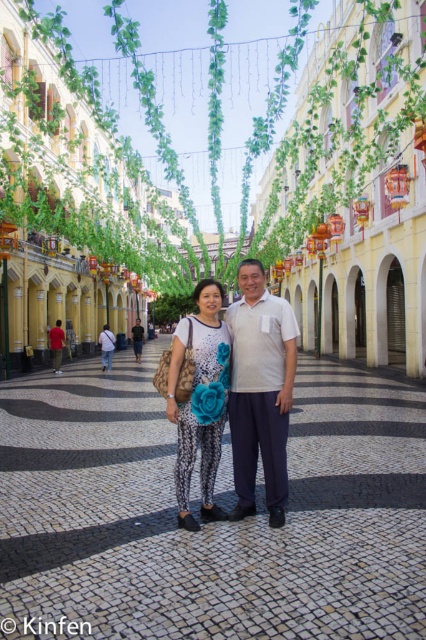
Can you confirm if printed fabric leggings at center is positioned to the left of red cotton shirt at center?

In fact, printed fabric leggings at center is to the right of red cotton shirt at center.

Between printed fabric leggings at center and red cotton shirt at center, which one has less height?

red cotton shirt at center

Which is in front, point (204, 364) or point (58, 368)?

Point (204, 364)

I want to click on printed fabric leggings at center, so click(x=199, y=394).

Does white cotton shirt at center have a lesser width compared to printed fabric leggings at center?

No.

Does white cotton shirt at center appear under printed fabric leggings at center?

No.

Where is `white cotton shirt at center`? This screenshot has width=426, height=640. white cotton shirt at center is located at coordinates (259, 390).

Identify the location of white cotton shirt at center. The height and width of the screenshot is (640, 426). (259, 390).

Is white cotton shirt at center closer to the viewer compared to matte white shirt at center?

Yes, white cotton shirt at center is in front of matte white shirt at center.

From the picture: Who is shorter, white cotton shirt at center or matte white shirt at center?

Standing shorter between the two is matte white shirt at center.

Who is more distant from viewer, (247, 394) or (138, 337)?

Positioned behind is point (138, 337).

The image size is (426, 640). Find the location of `white cotton shirt at center`. white cotton shirt at center is located at coordinates (259, 390).